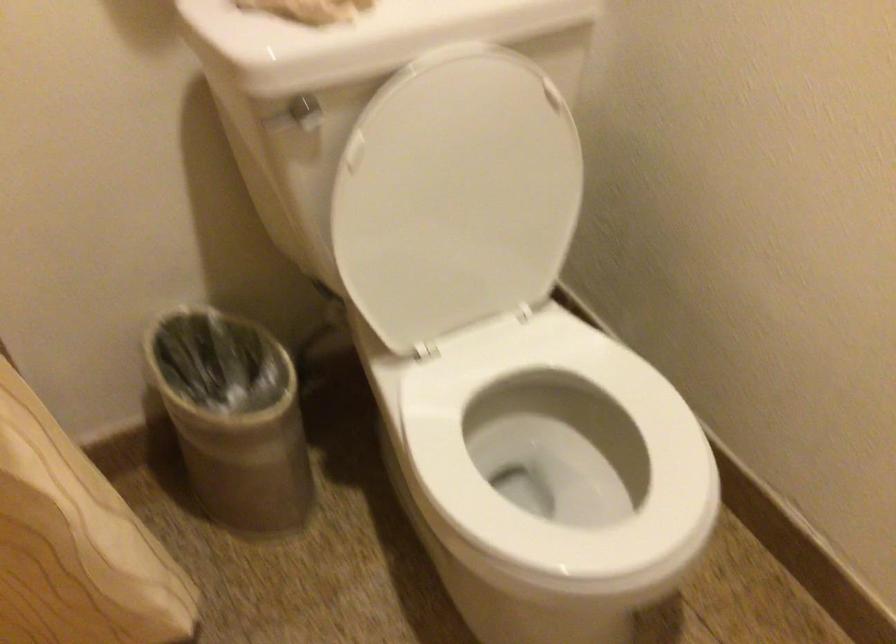
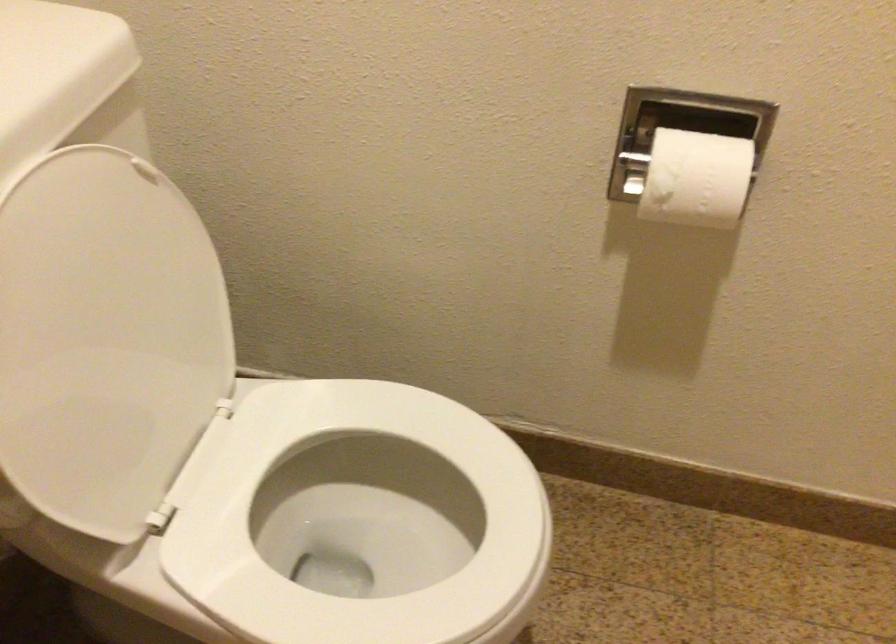
Question: How did the camera likely rotate?

Choices:
 (A) Left
 (B) Right
 (C) Up
 (D) Down

Answer: (B)